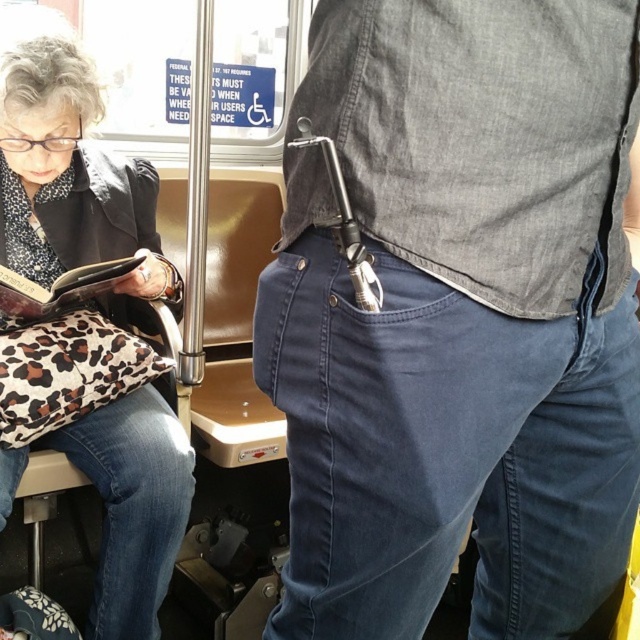
Is leopard print fabric purse at lower left closer to the viewer compared to leopard print fabric book at left?

No, leopard print fabric purse at lower left is behind leopard print fabric book at left.

Is leopard print fabric purse at lower left shorter than leopard print fabric book at left?

In fact, leopard print fabric purse at lower left may be taller than leopard print fabric book at left.

Between point (100, 541) and point (1, 305), which one is positioned in front?

Positioned in front is point (1, 305).

The image size is (640, 640). In order to click on leopard print fabric purse at lower left in this screenshot , I will do `click(70, 177)`.

Who is higher up, metallic silver tool at center or leopard print fabric purse at lower left?

leopard print fabric purse at lower left is above.

The height and width of the screenshot is (640, 640). Identify the location of metallic silver tool at center. (458, 317).

The height and width of the screenshot is (640, 640). What do you see at coordinates (458, 317) in the screenshot?
I see `metallic silver tool at center` at bounding box center [458, 317].

Find the location of a particular element. The width and height of the screenshot is (640, 640). metallic silver tool at center is located at coordinates (458, 317).

Does metallic silver tool at center have a smaller size compared to leopard print fabric book at left?

No, metallic silver tool at center is not smaller than leopard print fabric book at left.

Can you confirm if metallic silver tool at center is bigger than leopard print fabric book at left?

Indeed, metallic silver tool at center has a larger size compared to leopard print fabric book at left.

At what (x,y) coordinates should I click in order to perform the action: click on metallic silver tool at center. Please return your answer as a coordinate pair (x, y). This screenshot has height=640, width=640. Looking at the image, I should click on (458, 317).